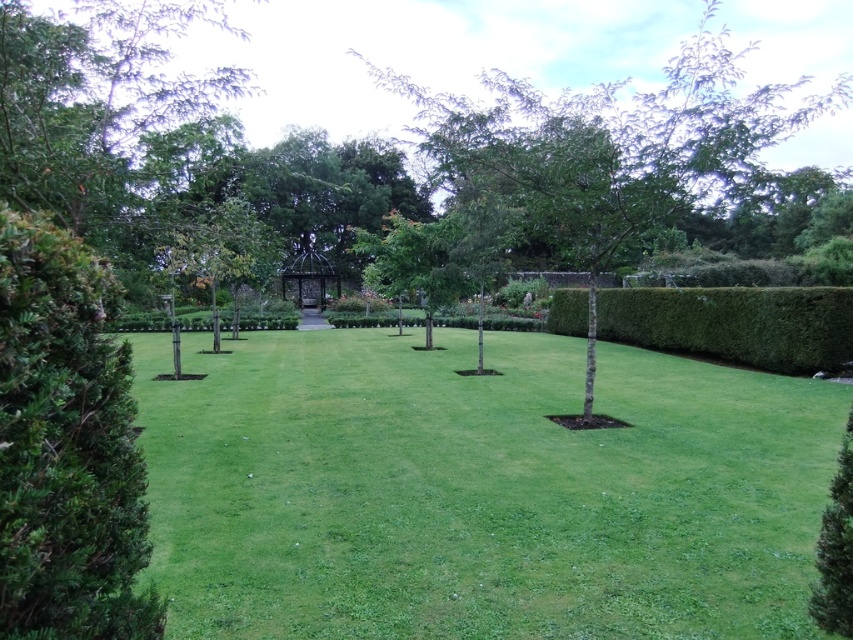
You are a gardener who wants to plant a new flower bed. You observe the green grass at center and the green leafy tree at center in the garden. Which object is located below the other?

The green grass at center is positioned under green leafy tree at center, meaning the grass is below the tree.

Consider the image. You are a gardener who needs to plant a new tree between the green grass at center and the dense hedge on the left. The tree requires a minimum of 10 feet of space to grow properly. Based on the scene description, will there be enough space for the tree?

The distance between the green grass at center and the dense hedge on the left is 8.43 feet. Since the tree requires a minimum of 10 feet of space, there is insufficient space to plant the tree there.